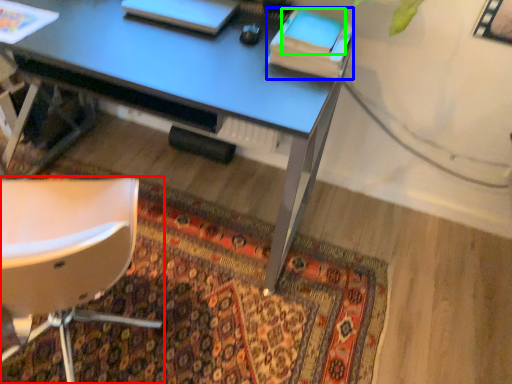
Question: Which is nearer to the chair (highlighted by a red box)? book (highlighted by a blue box) or notepad (highlighted by a green box).

Choices:
 (A) book
 (B) notepad

Answer: (A)